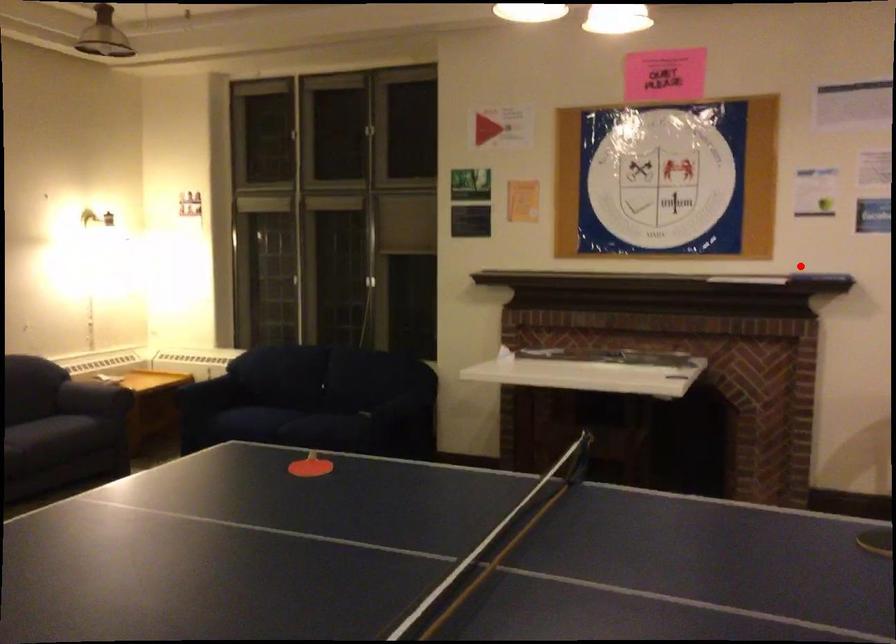
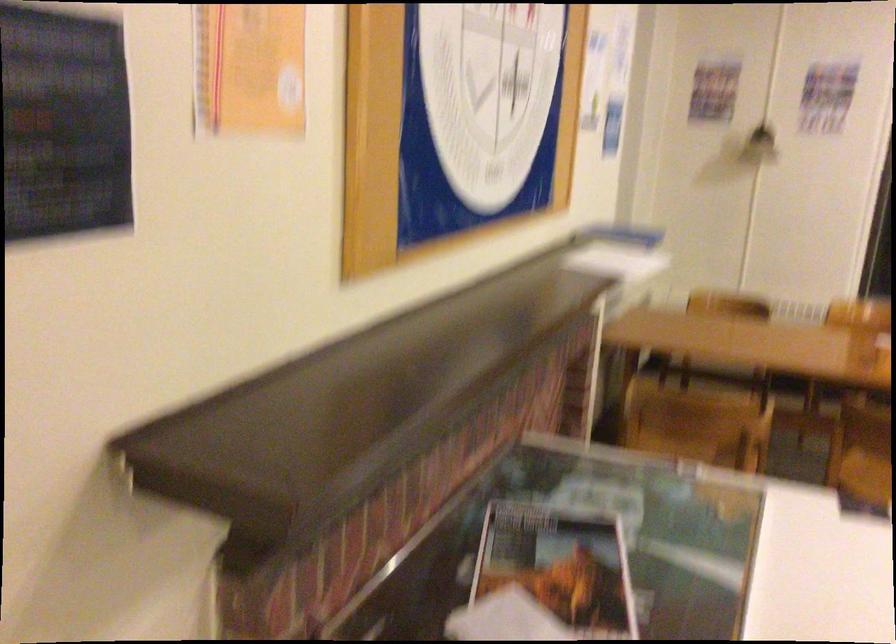
Question: I am providing you with two images of the same scene from different viewpoints. In image1, a red point is highlighted. Considering the same 3D point in image2, which of the following is correct?

Choices:
 (A) It is closer
 (B) It is farther

Answer: (A)